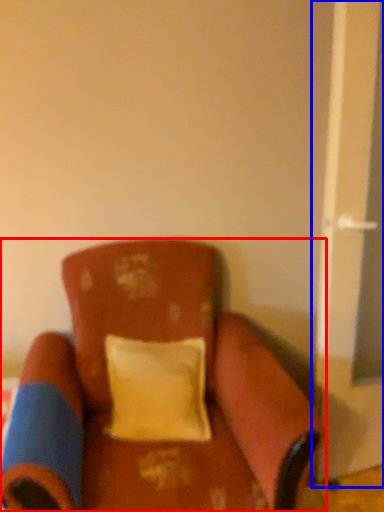
Question: Which of the following is the closest to the observer, chair (highlighted by a red box) or screen door (highlighted by a blue box)?

Choices:
 (A) chair
 (B) screen door

Answer: (A)